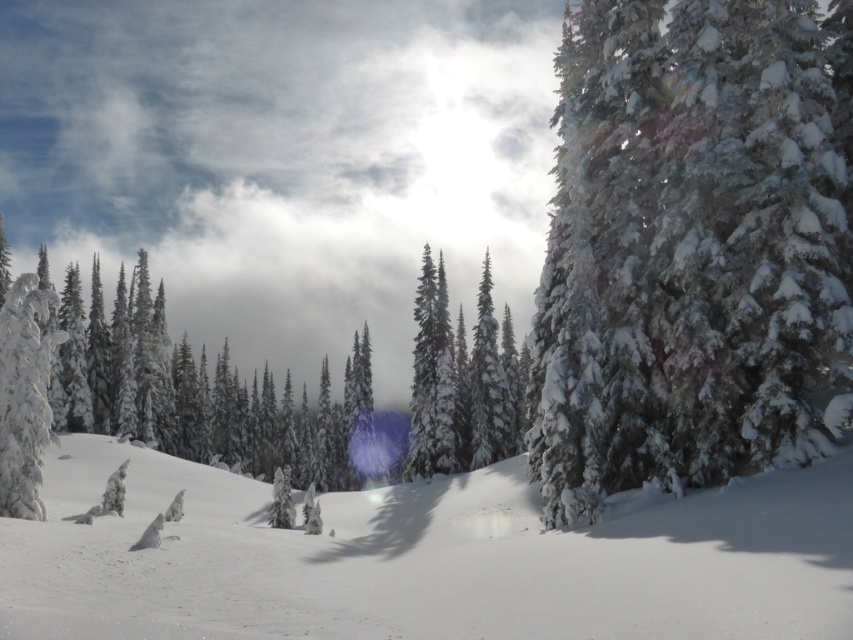
Question: Is snow-covered evergreen trees at center to the left of green matte tree at center from the viewer's perspective?

Choices:
 (A) no
 (B) yes

Answer: (A)

Question: Which of the following is the farthest from the observer?

Choices:
 (A) (426, 392)
 (B) (701, 531)
 (C) (461, 429)
 (D) (416, 67)

Answer: (D)

Question: Among these points, which one is farthest from the camera?

Choices:
 (A) (262, 428)
 (B) (500, 385)
 (C) (688, 300)
 (D) (445, 412)

Answer: (A)

Question: Is white snow at center to the left of snow-covered evergreen trees at center from the viewer's perspective?

Choices:
 (A) no
 (B) yes

Answer: (B)

Question: Does snow-covered evergreen trees at center appear on the right side of white frosty tree at left?

Choices:
 (A) no
 (B) yes

Answer: (B)

Question: Which of the following is the farthest from the observer?

Choices:
 (A) (247, 128)
 (B) (848, 499)

Answer: (A)